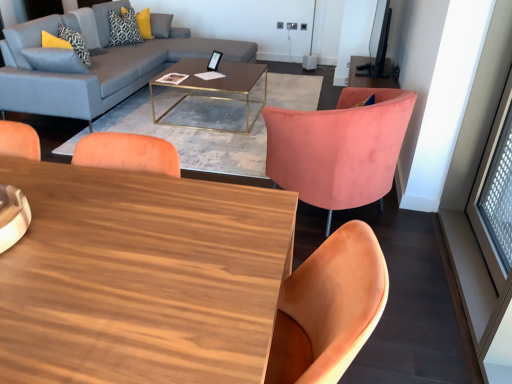
Question: From the image's perspective, does velvet pink chair at center appear higher than matte gray fabric couch at upper left?

Choices:
 (A) yes
 (B) no

Answer: (B)

Question: Considering the relative positions of velvet pink chair at center and matte gray fabric couch at upper left in the image provided, is velvet pink chair at center to the right of matte gray fabric couch at upper left from the viewer's perspective?

Choices:
 (A) yes
 (B) no

Answer: (A)

Question: Is the position of velvet pink chair at center less distant than that of matte gray fabric couch at upper left?

Choices:
 (A) yes
 (B) no

Answer: (A)

Question: Can you confirm if velvet pink chair at center is shorter than matte gray fabric couch at upper left?

Choices:
 (A) yes
 (B) no

Answer: (A)

Question: Could you tell me if velvet pink chair at center is facing matte gray fabric couch at upper left?

Choices:
 (A) yes
 (B) no

Answer: (A)

Question: Choose the correct answer: Is matte gray fabric couch at upper left inside patterned fabric pillow at upper left, the 1th pillow ordered from the bottom, or outside it?

Choices:
 (A) outside
 (B) inside

Answer: (A)

Question: In terms of width, does matte gray fabric couch at upper left look wider or thinner when compared to patterned fabric pillow at upper left, which is counted as the 2th pillow, starting from the top?

Choices:
 (A) wide
 (B) thin

Answer: (A)

Question: Based on their positions, is matte gray fabric couch at upper left located to the left or right of patterned fabric pillow at upper left, the 2th pillow positioned from the back?

Choices:
 (A) right
 (B) left

Answer: (A)

Question: Considering the positions of matte gray fabric couch at upper left and patterned fabric pillow at upper left, acting as the first pillow starting from the front, in the image, is matte gray fabric couch at upper left taller or shorter than patterned fabric pillow at upper left, acting as the first pillow starting from the front,?

Choices:
 (A) short
 (B) tall

Answer: (B)

Question: Is yellow textured pillow at upper left, which is the second pillow from bottom to top, situated inside wooden coffee table at center, the first coffee table positioned from the front, or outside?

Choices:
 (A) outside
 (B) inside

Answer: (A)

Question: Is yellow textured pillow at upper left, marked as the 1th pillow in a top-to-bottom arrangement, wider or thinner than wooden coffee table at center, the first coffee table positioned from the front?

Choices:
 (A) wide
 (B) thin

Answer: (B)

Question: In terms of height, does yellow textured pillow at upper left, marked as the 1th pillow in a top-to-bottom arrangement, look taller or shorter compared to wooden coffee table at center, the 2th coffee table from the top?

Choices:
 (A) short
 (B) tall

Answer: (A)

Question: Is yellow textured pillow at upper left, positioned as the 1th pillow in back-to-front order, bigger or smaller than wooden coffee table at center, the 2th coffee table from the top?

Choices:
 (A) small
 (B) big

Answer: (A)

Question: Looking at the image, does metallic gold coffee table at center, positioned as the 1th coffee table in top-to-bottom order, seem bigger or smaller compared to yellow textured pillow at upper left, positioned as the 1th pillow in back-to-front order?

Choices:
 (A) small
 (B) big

Answer: (B)

Question: Relative to yellow textured pillow at upper left, which is the second pillow from bottom to top, is metallic gold coffee table at center, positioned as the 1th coffee table in top-to-bottom order, in front or behind?

Choices:
 (A) front
 (B) behind

Answer: (A)